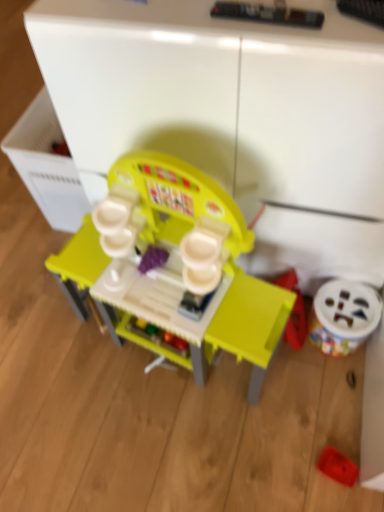
Question: Considering their positions, is white plastic drawer at left located in front of or behind matte plastic play kitchen at center, the first toy when ordered from left to right?

Choices:
 (A) front
 (B) behind

Answer: (B)

Question: From a real-world perspective, is white plastic drawer at left physically located above or below matte plastic play kitchen at center, the first toy when ordered from left to right?

Choices:
 (A) below
 (B) above

Answer: (A)

Question: Estimate the real-world distances between objects in this image. Which object is closer to the matte plastic play kitchen at center, positioned as the 3th toy in right-to-left order?

Choices:
 (A) white plastic toy at lower right, the third toy when ordered from left to right
 (B) rubberized red tray at lower right, the second toy from the right
 (C) white plastic drawer at left

Answer: (C)

Question: Which object is the farthest from the white plastic toy at lower right, which appears as the first toy when viewed from the right?

Choices:
 (A) rubberized red tray at lower right, the second toy from the right
 (B) white plastic drawer at left
 (C) matte plastic play kitchen at center, positioned as the 3th toy in right-to-left order

Answer: (B)